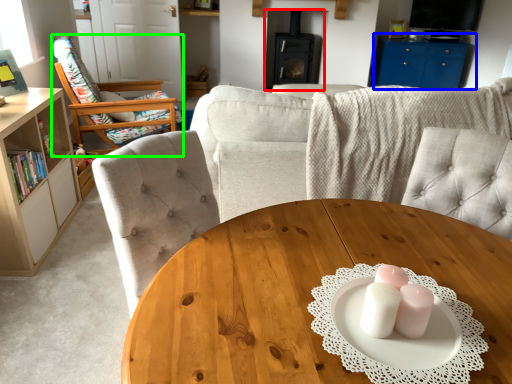
Question: Which object is positioned closest to fireplace (highlighted by a red box)? Select from entertainment center (highlighted by a blue box) and chair (highlighted by a green box).

Choices:
 (A) entertainment center
 (B) chair

Answer: (A)